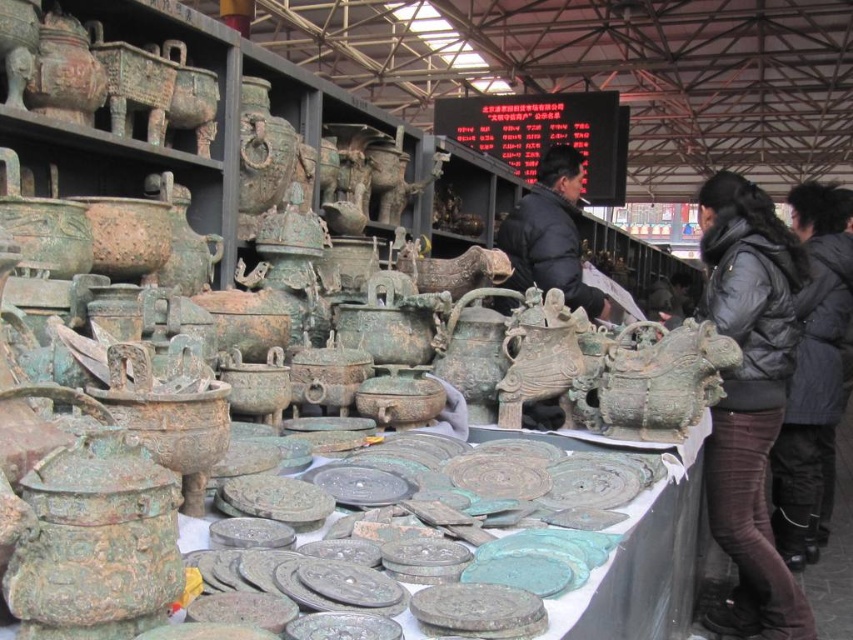
Looking at this image, you are a customer at the indoor market looking to purchase a bronze artifact. You see the dark gray puffy jacket at right and the black puffy jacket at right hanging on a rack. Which jacket is positioned lower on the rack?

The dark gray puffy jacket at right is located below the black puffy jacket at right, so it is positioned lower on the rack.

You are a customer at the indoor market and see the black puffy jacket at right and the black matte jacket at center. Which jacket is taller?

The black puffy jacket at right is taller than the black matte jacket at center.